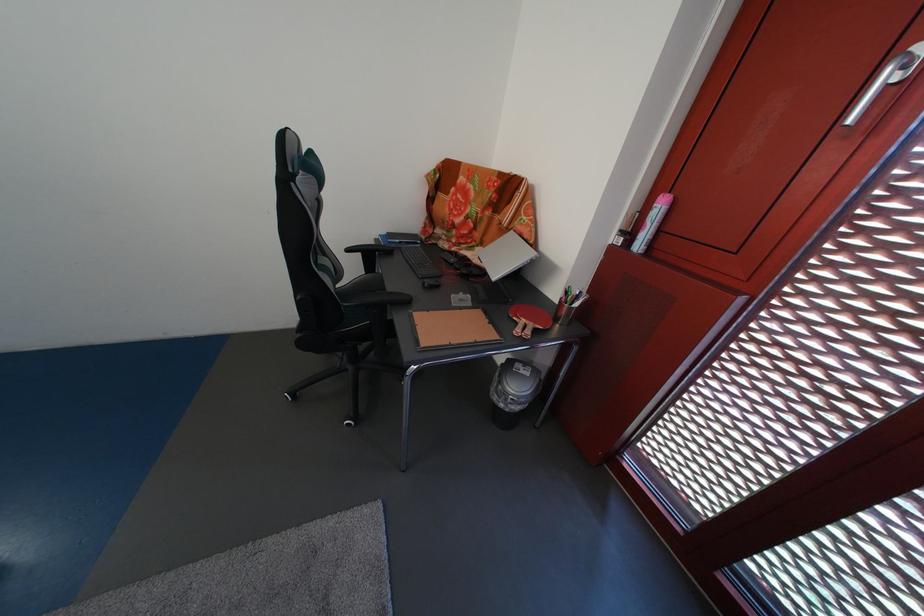
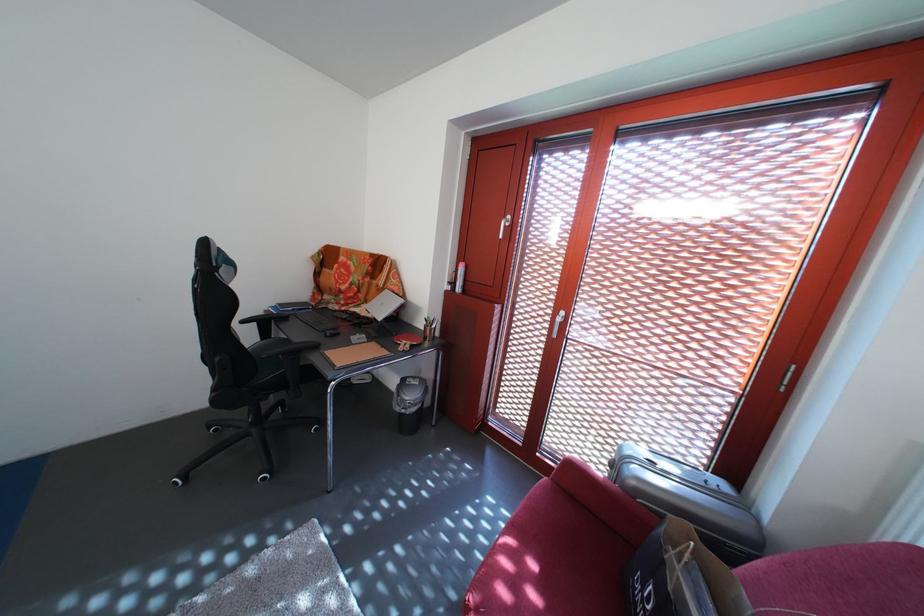
Question: The camera is either moving clockwise (left) or counter-clockwise (right) around the object. The first image is from the beginning of the video and the second image is from the end. Is the camera moving left or right when shooting the video?

Choices:
 (A) Left
 (B) Right

Answer: (A)